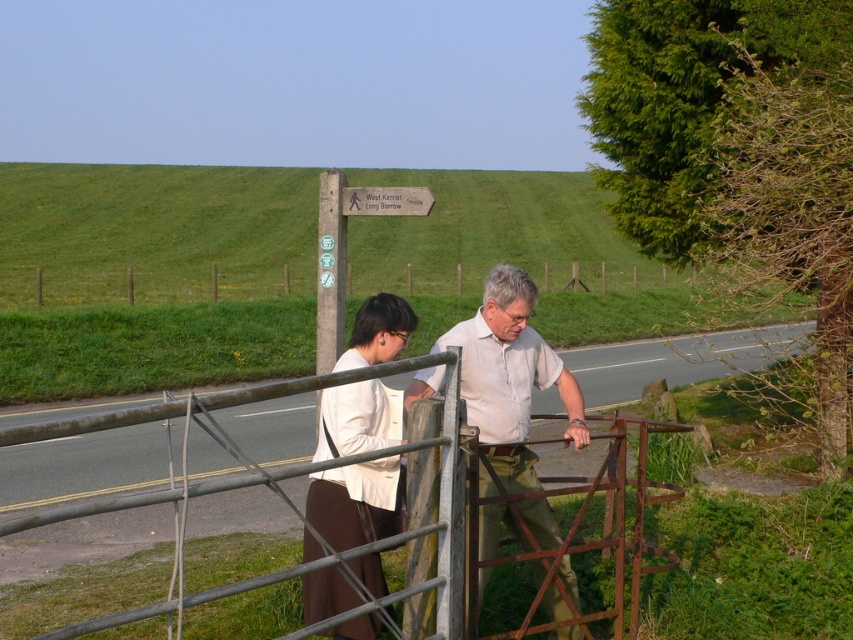
Which is more to the right, light beige shirt at center or white fabric jacket at center?

Positioned to the right is light beige shirt at center.

Consider the image. Can you confirm if light beige shirt at center is positioned to the right of white fabric jacket at center?

Correct, you'll find light beige shirt at center to the right of white fabric jacket at center.

Is point (468, 360) positioned after point (399, 438)?

Yes, it is behind point (399, 438).

Locate an element on the screen. This screenshot has width=853, height=640. light beige shirt at center is located at coordinates (509, 376).

Between rusty metal gate at center and white fabric jacket at center, which one appears on the right side from the viewer's perspective?

From the viewer's perspective, rusty metal gate at center appears more on the right side.

Who is taller, rusty metal gate at center or white fabric jacket at center?

With more height is white fabric jacket at center.

The image size is (853, 640). I want to click on rusty metal gate at center, so [285, 465].

Where is `light beige shirt at center`? The width and height of the screenshot is (853, 640). light beige shirt at center is located at coordinates (509, 376).

Between light beige shirt at center and wooden signpost at upper center, which one has more height?

wooden signpost at upper center

Find the location of a particular element. The image size is (853, 640). light beige shirt at center is located at coordinates (509, 376).